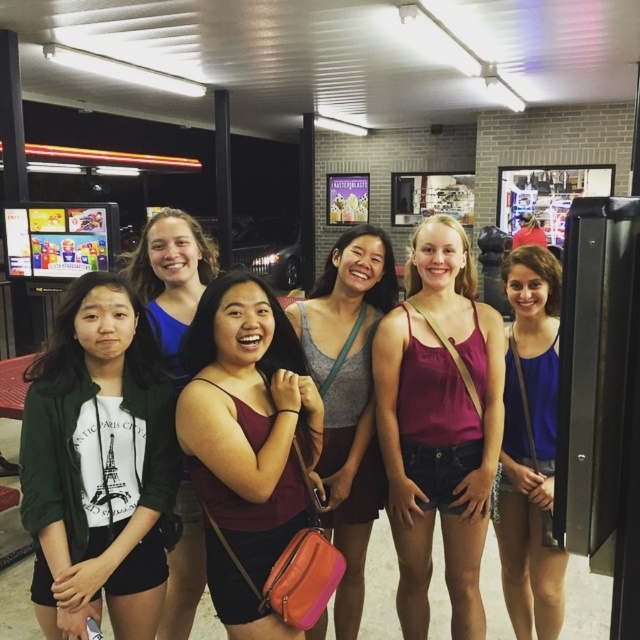
Does matte gray tank top at center appear on the left side of white cotton shirt at left?

In fact, matte gray tank top at center is to the right of white cotton shirt at left.

I want to click on matte gray tank top at center, so click(348, 397).

Does point (332, 499) come behind point (164, 310)?

No, (332, 499) is in front of (164, 310).

At what (x,y) coordinates should I click in order to perform the action: click on matte gray tank top at center. Please return your answer as a coordinate pair (x, y). The height and width of the screenshot is (640, 640). Looking at the image, I should click on (348, 397).

What are the coordinates of `matte red tank top at center` in the screenshot? It's located at (248, 442).

Can you confirm if matte red tank top at center is positioned above matte gray tank top at center?

Yes, matte red tank top at center is above matte gray tank top at center.

Locate an element on the screen. The width and height of the screenshot is (640, 640). matte red tank top at center is located at coordinates click(x=248, y=442).

You are a GUI agent. You are given a task and a screenshot of the screen. Output one action in this format:
    pyautogui.click(x=<x>, y=<y>)
    Task: Click on the matte red tank top at center
    This screenshot has height=640, width=640.
    Given the screenshot: What is the action you would take?
    pyautogui.click(x=248, y=442)

Between matte pink tank top at center and matte red tank top at center, which one appears on the left side from the viewer's perspective?

Positioned to the left is matte red tank top at center.

Between point (388, 508) and point (252, 618), which one is positioned behind?

Point (388, 508)

Where is `matte pink tank top at center`? The width and height of the screenshot is (640, 640). matte pink tank top at center is located at coordinates (440, 426).